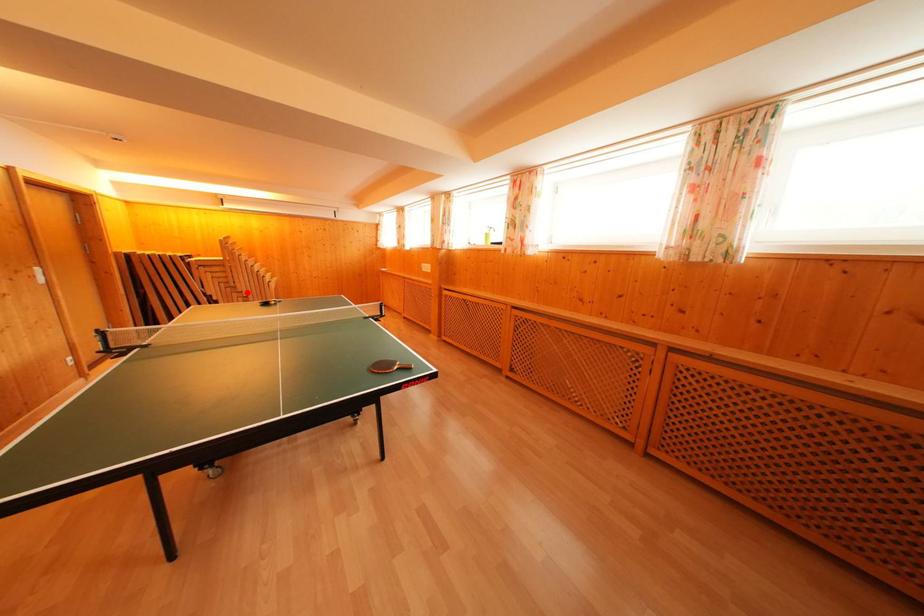
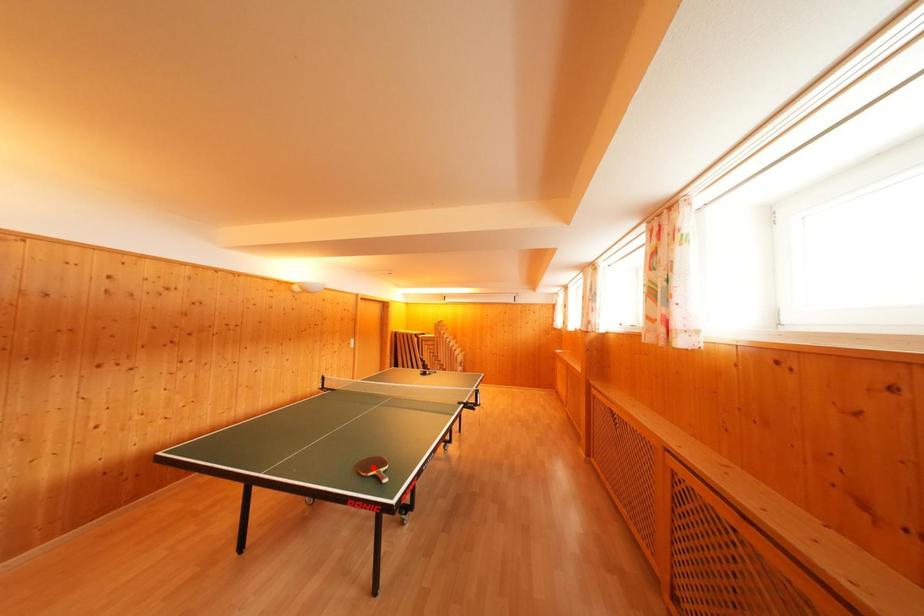
I am providing you with two images of the same scene from different viewpoints. A red point is marked on the first image and another point is marked on the second image. Do the highlighted points in image1 and image2 indicate the same real-world spot?

No